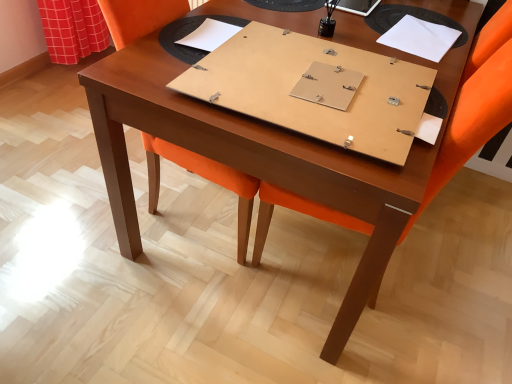
What are the coordinates of `vacant area located to the right-hand side of white cardboard notebook at upper center, marked as the first notebook in a left-to-right arrangement` in the screenshot? It's located at (269, 44).